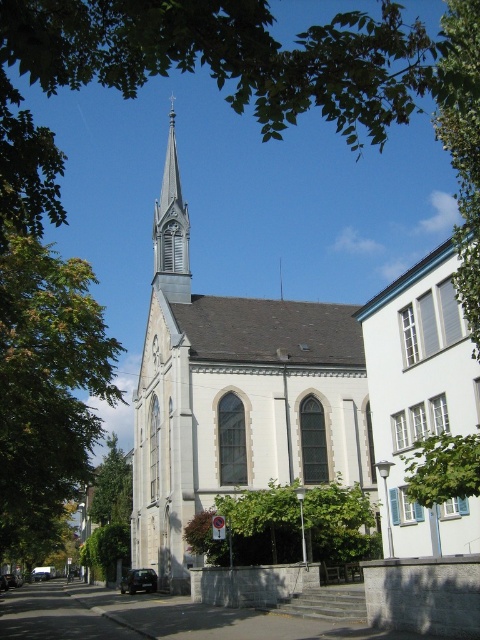
You are standing in front of the historic church and notice a green leafy tree at center. Based on its coordinates, is the tree positioned closer to the left or right side of the church?

The green leafy tree at center is located at point 0.825 on the x and y axis, which means it is positioned closer to the right side of the church.

You are a city planner assessing the spacing between two green leafy trees in front of the historic church. Given that the recommended minimum distance between trees for proper growth is 25 meters, does the current spacing between the green leafy tree at center and the green leafy tree at upper center meet this requirement?

The green leafy tree at center and green leafy tree at upper center are 26.45 meters apart from each other, which exceeds the recommended minimum distance of 25 meters. Therefore, the spacing between the green leafy tree at center and the green leafy tree at upper center meets the growth requirement.